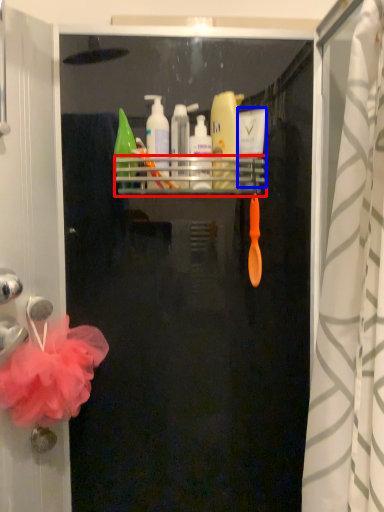
Question: Which object is further to the camera taking this photo, shelf (highlighted by a red box) or toiletry (highlighted by a blue box)?

Choices:
 (A) shelf
 (B) toiletry

Answer: (B)